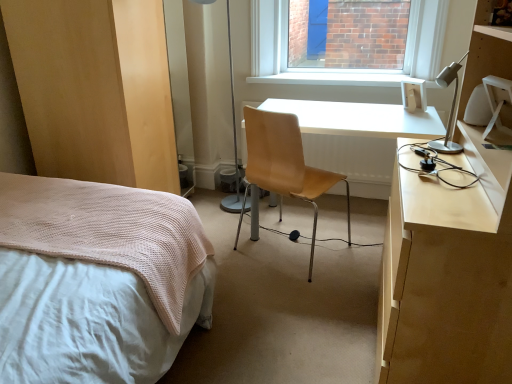
What is the approximate width of white smooth window sill at upper center?

The width of white smooth window sill at upper center is 9.32 inches.

The height and width of the screenshot is (384, 512). I want to click on white smooth window sill at upper center, so click(339, 79).

I want to click on light brown wood dresser at lower left, so click(95, 89).

What do you see at coordinates (95, 89) in the screenshot?
I see `light brown wood dresser at lower left` at bounding box center [95, 89].

I want to click on metallic silver table lamp at center, so click(209, 89).

What do you see at coordinates (209, 89) in the screenshot? I see `metallic silver table lamp at center` at bounding box center [209, 89].

The width and height of the screenshot is (512, 384). Describe the element at coordinates (97, 280) in the screenshot. I see `white textured bed at left` at that location.

Measure the distance between point [352,122] and camera.

They are 7.26 feet apart.

The height and width of the screenshot is (384, 512). I want to click on white smooth window sill at upper center, so click(339, 79).

Who is bigger, white glossy desk at center or light brown wood dresser at lower left?

light brown wood dresser at lower left.

Where is `dresser in front of the white glossy desk at center`? This screenshot has width=512, height=384. dresser in front of the white glossy desk at center is located at coordinates tap(95, 89).

Is white glossy desk at center shorter than light brown wood dresser at lower left?

Indeed, white glossy desk at center has a lesser height compared to light brown wood dresser at lower left.

Can you confirm if white glossy desk at center is wider than light brown leather chair at center?

Indeed, white glossy desk at center has a greater width compared to light brown leather chair at center.

Which object is further away from the camera taking this photo, white glossy desk at center or light brown leather chair at center?

white glossy desk at center is more distant.

Between white glossy desk at center and light brown leather chair at center, which one has larger size?

With larger size is white glossy desk at center.

The image size is (512, 384). I want to click on desk that is under the light brown leather chair at center (from a real-world perspective), so click(x=359, y=119).

Could you tell me if light brown wood dresser at lower left is turned towards white glossy desk at center?

Yes, light brown wood dresser at lower left faces towards white glossy desk at center.

From the picture: Are light brown wood dresser at lower left and white glossy desk at center far apart?

Yes, light brown wood dresser at lower left is far from white glossy desk at center.

Is point (149, 33) in front of point (339, 114)?

That is True.

Is light brown wood dresser at lower left wider than white glossy desk at center?

Indeed, light brown wood dresser at lower left has a greater width compared to white glossy desk at center.

From a real-world perspective, between silver metallic desk lamp at upper right and white textured bed at left, who is vertically higher?

silver metallic desk lamp at upper right is physically above.

What's the angular difference between silver metallic desk lamp at upper right and white textured bed at left's facing directions?

The angular difference between silver metallic desk lamp at upper right and white textured bed at left is 89.8 degrees.

Based on their positions, is silver metallic desk lamp at upper right located to the left or right of white textured bed at left?

silver metallic desk lamp at upper right is to the right of white textured bed at left.

Does silver metallic desk lamp at upper right have a greater width compared to white textured bed at left?

In fact, silver metallic desk lamp at upper right might be narrower than white textured bed at left.

Is white glossy desk at center bigger or smaller than metallic silver table lamp at center?

white glossy desk at center is bigger than metallic silver table lamp at center.

Would you say metallic silver table lamp at center is part of white glossy desk at center's contents?

No, metallic silver table lamp at center is not a part of white glossy desk at center.

Looking at this image, is white glossy desk at center positioned before metallic silver table lamp at center?

Yes.

Can you confirm if white glossy desk at center is positioned to the right of metallic silver table lamp at center?

Yes, white glossy desk at center is to the right of metallic silver table lamp at center.

Which of these two, white smooth window sill at upper center or light brown leather chair at center, is thinner?

With smaller width is white smooth window sill at upper center.

From the picture: From the image's perspective, who appears lower, white smooth window sill at upper center or light brown leather chair at center?

light brown leather chair at center appears lower in the image.

Does white smooth window sill at upper center have a lesser height compared to light brown leather chair at center?

Yes.

In the scene shown: Is white smooth window sill at upper center located outside light brown leather chair at center?

Yes, white smooth window sill at upper center is located beyond the bounds of light brown leather chair at center.

Is the depth of silver metallic desk lamp at upper right greater than that of metallic silver table lamp at center?

That is False.

Which is more distant, [448,151] or [236,100]?

The point [236,100] is behind.

How many degrees apart are the facing directions of silver metallic desk lamp at upper right and metallic silver table lamp at center?

The angular difference between silver metallic desk lamp at upper right and metallic silver table lamp at center is 90 degrees.

You are a GUI agent. You are given a task and a screenshot of the screen. Output one action in this format:
    pyautogui.click(x=<x>, y=<y>)
    Task: Click on the dresser positioned vertically above the white glossy desk at center (from a real-world perspective)
    The width and height of the screenshot is (512, 384).
    Given the screenshot: What is the action you would take?
    pyautogui.click(x=95, y=89)

The height and width of the screenshot is (384, 512). In order to click on chair in front of the white glossy desk at center in this screenshot , I will do `click(284, 165)`.

Based on the photo, looking at the image, which one is located closer to metallic silver table lamp at center, silver metallic desk lamp at upper right or light brown wood dresser at lower left?

Based on the image, light brown wood dresser at lower left appears to be nearer to metallic silver table lamp at center.

Estimate the real-world distances between objects in this image. Which object is further from light brown wood dresser at lower left, silver metallic desk lamp at upper right or light brown leather chair at center?

silver metallic desk lamp at upper right is positioned further to the anchor light brown wood dresser at lower left.

Estimate the real-world distances between objects in this image. Which object is further from white smooth window sill at upper center, light brown leather chair at center or light brown wood dresser at lower left?

light brown wood dresser at lower left.

Which object lies nearer to the anchor point metallic silver table lamp at center, silver metallic desk lamp at upper right or white glossy desk at center?

The object closer to metallic silver table lamp at center is white glossy desk at center.

Based on their spatial positions, is silver metallic desk lamp at upper right or white textured bed at left closer to light brown leather chair at center?

silver metallic desk lamp at upper right is positioned closer to the anchor light brown leather chair at center.

Which object lies further to the anchor point light brown wood dresser at lower left, silver metallic desk lamp at upper right or white glossy desk at center?

silver metallic desk lamp at upper right is positioned further to the anchor light brown wood dresser at lower left.

Looking at the image, which one is located further to white smooth window sill at upper center, white textured bed at left or light brown leather chair at center?

Among the two, white textured bed at left is located further to white smooth window sill at upper center.

Looking at the image, which one is located closer to silver metallic desk lamp at upper right, light brown leather chair at center or light brown wood dresser at lower left?

Among the two, light brown leather chair at center is located nearer to silver metallic desk lamp at upper right.

The image size is (512, 384). In order to click on table lamp between light brown wood dresser at lower left and silver metallic desk lamp at upper right in the horizontal direction in this screenshot , I will do (x=209, y=89).

What are the coordinates of `chair between light brown wood dresser at lower left and silver metallic desk lamp at upper right` in the screenshot? It's located at (284, 165).

Image resolution: width=512 pixels, height=384 pixels. Identify the location of chair between white textured bed at left and metallic silver table lamp at center along the z-axis. [284, 165].

I want to click on chair located between metallic silver table lamp at center and white glossy desk at center in the left-right direction, so click(x=284, y=165).